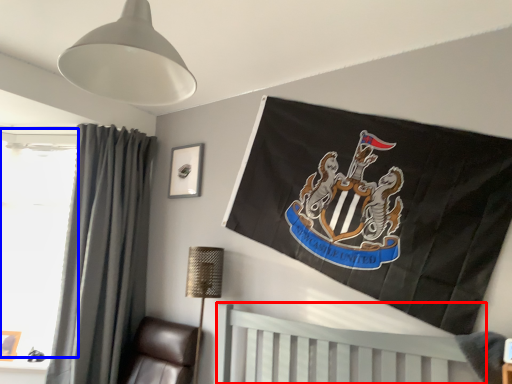
Question: Which of the following is the closest to the observer, furniture (highlighted by a red box) or window screen (highlighted by a blue box)?

Choices:
 (A) furniture
 (B) window screen

Answer: (A)